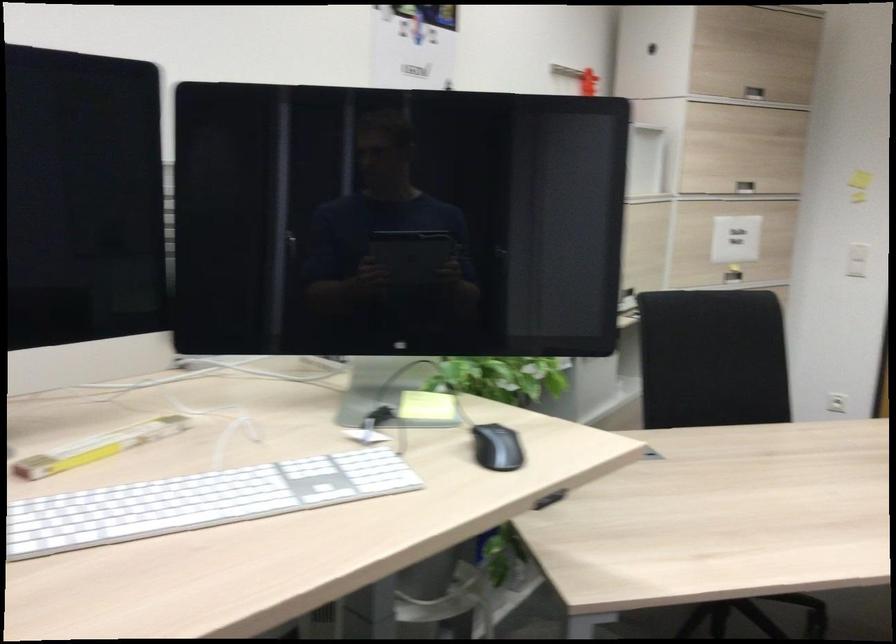
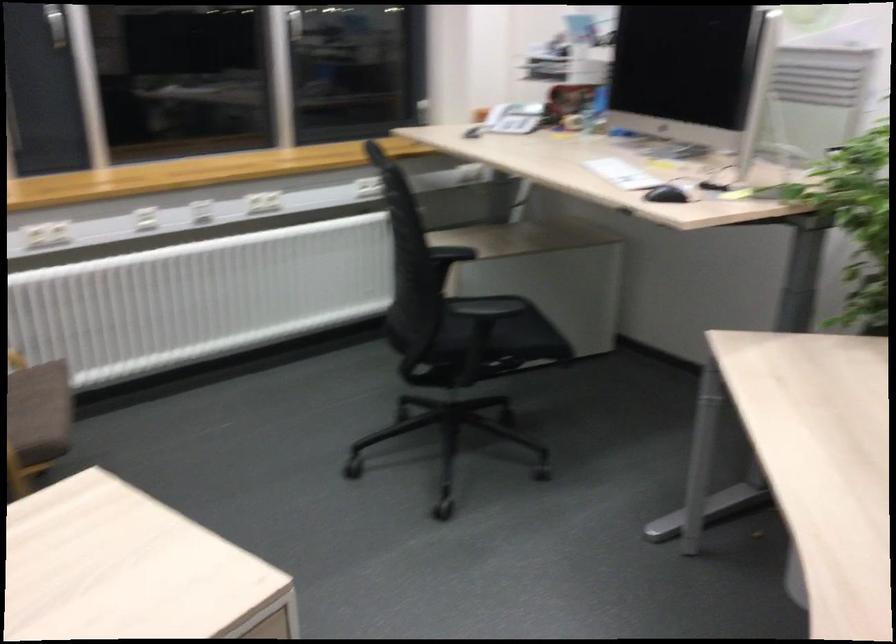
The point at (485, 458) is marked in the first image. Where is the corresponding point in the second image?

(666, 194)